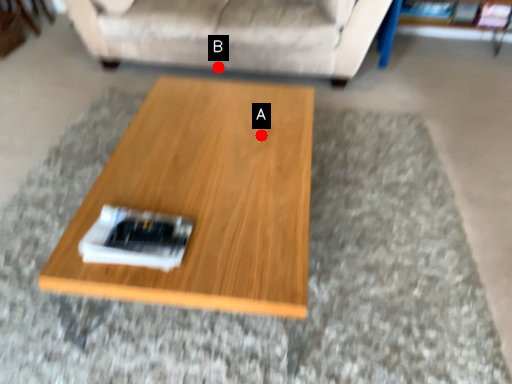
Question: Two points are circled on the image, labeled by A and B beside each circle. Which of the following is the farthest from the observer?

Choices:
 (A) A is further
 (B) B is further

Answer: (B)